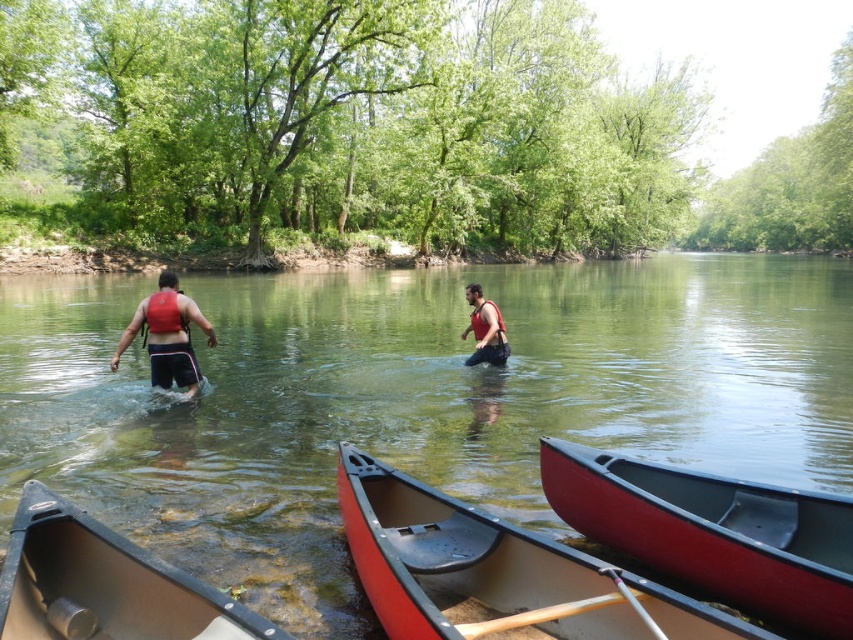
Is green smooth water at center smaller than shiny red canoe at lower center?

No, green smooth water at center is not smaller than shiny red canoe at lower center.

Does green smooth water at center have a lesser width compared to shiny red canoe at lower center?

No, green smooth water at center is not thinner than shiny red canoe at lower center.

Between point (308, 362) and point (717, 545), which one is positioned behind?

The point (308, 362) is more distant.

Locate an element on the screen. green smooth water at center is located at coordinates coord(415,401).

Measure the distance between red matte life vest at left and wooden paddle at lower center.

red matte life vest at left is 6.98 meters from wooden paddle at lower center.

Is point (148, 308) positioned before point (534, 611)?

That is False.

Which is in front, point (151, 365) or point (527, 611)?

Point (527, 611)

In order to click on red matte life vest at left in this screenshot , I will do `click(167, 336)`.

Looking at this image, which of these two, matte red canoe at lower center or wooden paddle at lower center, stands shorter?

Standing shorter between the two is wooden paddle at lower center.

Is matte red canoe at lower center wider than wooden paddle at lower center?

Yes, matte red canoe at lower center is wider than wooden paddle at lower center.

Locate an element on the screen. matte red canoe at lower center is located at coordinates (495, 572).